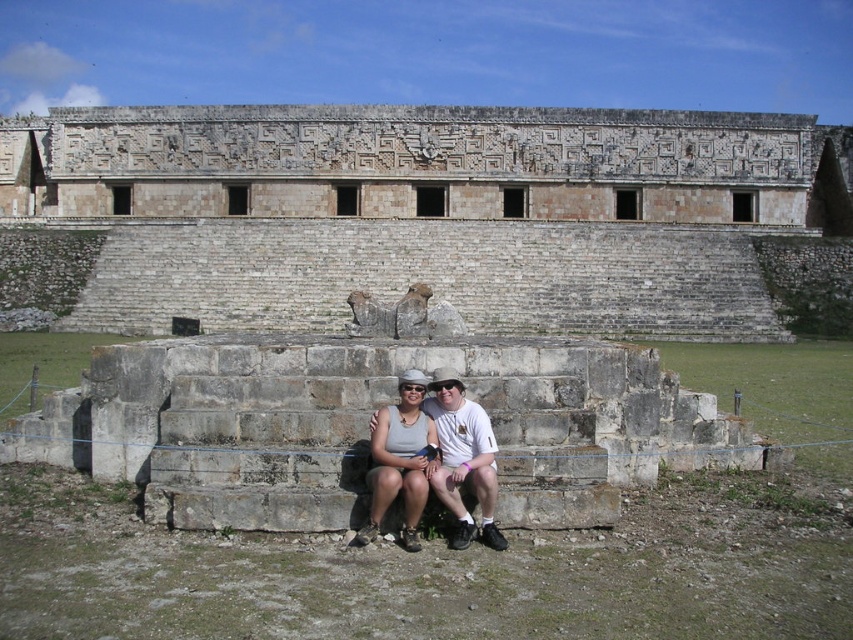
Question: In this image, where is stone amphitheater at center located relative to matte gray stone couple at center?

Choices:
 (A) left
 (B) right

Answer: (A)

Question: Is stone amphitheater at center thinner than matte gray stone couple at center?

Choices:
 (A) no
 (B) yes

Answer: (A)

Question: Is stone amphitheater at center bigger than matte gray stone couple at center?

Choices:
 (A) yes
 (B) no

Answer: (A)

Question: Which point is closer to the camera taking this photo?

Choices:
 (A) (462, 275)
 (B) (428, 404)

Answer: (B)